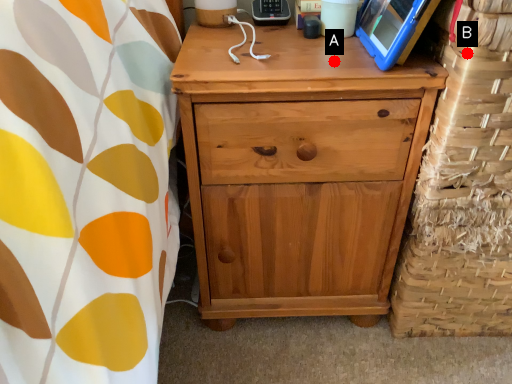
Question: Two points are circled on the image, labeled by A and B beside each circle. Which point is closer to the camera taking this photo?

Choices:
 (A) A is closer
 (B) B is closer

Answer: (B)